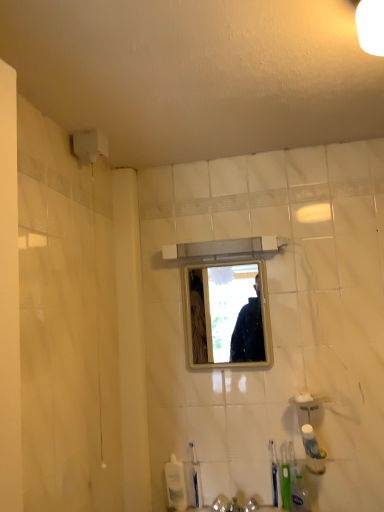
Question: Would you say white plastic toothpaste tube at lower right, which is the first toiletry from front to back, is part of green plastic toothbrush at lower right, which is the 1th toothbrush from right to left,'s contents?

Choices:
 (A) yes
 (B) no

Answer: (B)

Question: Does green plastic toothbrush at lower right, which is the 1th toothbrush from right to left, have a greater height compared to white plastic toothpaste tube at lower right, the first toiletry viewed from the top?

Choices:
 (A) no
 (B) yes

Answer: (B)

Question: Does green plastic toothbrush at lower right, which is the 1th toothbrush from right to left, lie in front of white plastic toothpaste tube at lower right, which is the first toiletry from front to back?

Choices:
 (A) no
 (B) yes

Answer: (A)

Question: Is green plastic toothbrush at lower right, which ranks as the third toothbrush in left-to-right order, positioned with its back to white plastic toothpaste tube at lower right, the first toiletry viewed from the top?

Choices:
 (A) yes
 (B) no

Answer: (B)

Question: Does green plastic toothbrush at lower right, which ranks as the third toothbrush in left-to-right order, touch white plastic toothpaste tube at lower right, the 2th toiletry positioned from the back?

Choices:
 (A) no
 (B) yes

Answer: (B)

Question: Considering the positions of blue plastic toothbrush at lower center, which appears as the 3th toothbrush when viewed from the right, and green plastic toothbrush at lower right, which ranks as the third toothbrush in left-to-right order, in the image, is blue plastic toothbrush at lower center, which appears as the 3th toothbrush when viewed from the right, bigger or smaller than green plastic toothbrush at lower right, which ranks as the third toothbrush in left-to-right order,?

Choices:
 (A) big
 (B) small

Answer: (B)

Question: Considering the positions of blue plastic toothbrush at lower center, which appears as the 3th toothbrush when viewed from the right, and green plastic toothbrush at lower right, which is the 1th toothbrush from right to left, in the image, is blue plastic toothbrush at lower center, which appears as the 3th toothbrush when viewed from the right, taller or shorter than green plastic toothbrush at lower right, which is the 1th toothbrush from right to left,?

Choices:
 (A) short
 (B) tall

Answer: (A)

Question: From a real-world perspective, is blue plastic toothbrush at lower center, which is counted as the 1th toothbrush, starting from the left, physically located above or below green plastic toothbrush at lower right, which is the 1th toothbrush from right to left?

Choices:
 (A) above
 (B) below

Answer: (B)

Question: From the image's perspective, is blue plastic toothbrush at lower center, which appears as the 3th toothbrush when viewed from the right, above or below green plastic toothbrush at lower right, which is the 1th toothbrush from right to left?

Choices:
 (A) below
 (B) above

Answer: (A)

Question: Is green plastic toothbrush at lower right, which is the 1th toothbrush from right to left, spatially inside clear glass mirror at center, or outside of it?

Choices:
 (A) outside
 (B) inside

Answer: (A)

Question: In the image, is green plastic toothbrush at lower right, which is the 1th toothbrush from right to left, on the left side or the right side of clear glass mirror at center?

Choices:
 (A) right
 (B) left

Answer: (A)

Question: Is green plastic toothbrush at lower right, which ranks as the third toothbrush in left-to-right order, bigger or smaller than clear glass mirror at center?

Choices:
 (A) big
 (B) small

Answer: (B)

Question: From a real-world perspective, is green plastic toothbrush at lower right, which is the 1th toothbrush from right to left, positioned above or below clear glass mirror at center?

Choices:
 (A) below
 (B) above

Answer: (A)

Question: Is point (200, 501) positioned closer to the camera than point (269, 442)?

Choices:
 (A) closer
 (B) farther

Answer: (B)

Question: Is blue plastic toothbrush at lower center, which is counted as the 1th toothbrush, starting from the left, in front of or behind green plastic toothbrush at lower right, which ranks as the second toothbrush in left-to-right order, in the image?

Choices:
 (A) front
 (B) behind

Answer: (B)